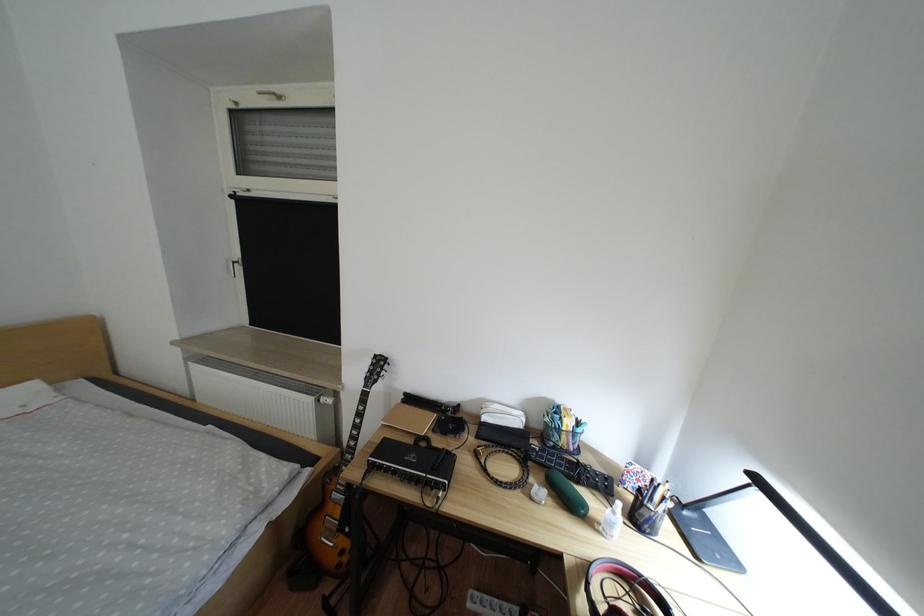
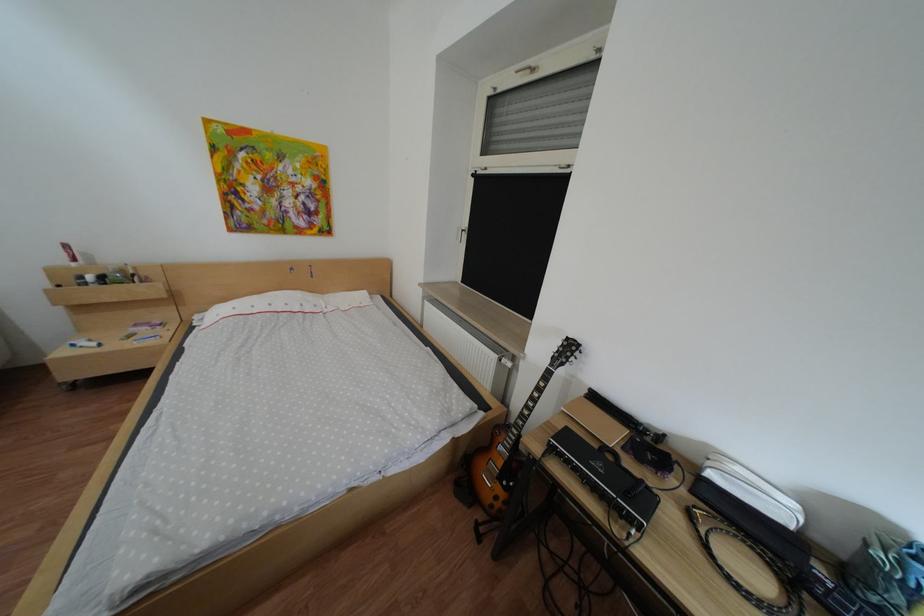
Question: The first image is from the beginning of the video and the second image is from the end. How did the camera likely rotate when shooting the video?

Choices:
 (A) Left
 (B) Right
 (C) Up
 (D) Down

Answer: (A)